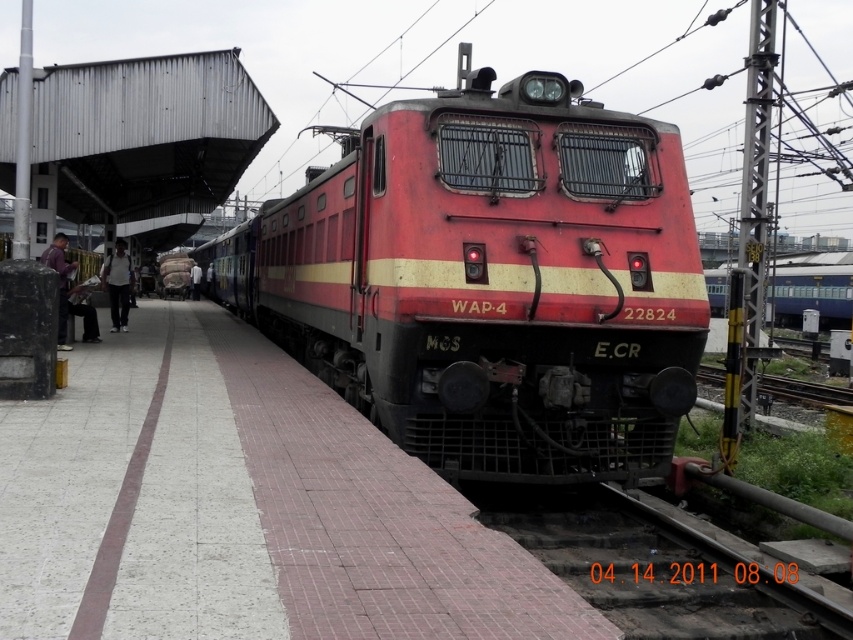
You are a passenger waiting at the platform and want to board the metallic blue train at right. The white clothed person at center is blocking your path. Which direction should you move to go around them and reach the train?

Since the metallic blue train at right is located below the white clothed person at center, you should move to the left of the white clothed person at center to reach the train.

You are a passenger waiting at the station. You see the red matte train at center and the purple fabric bag at left. Which object is closer to you?

The red matte train at center is closer to you because it is in front of the purple fabric bag at left.

You are a passenger waiting at the platform and see the red matte train at center and the purple fabric bag at left. Which object is positioned higher from the ground?

The red matte train at center is located above the purple fabric bag at left, so it is positioned higher from the ground.